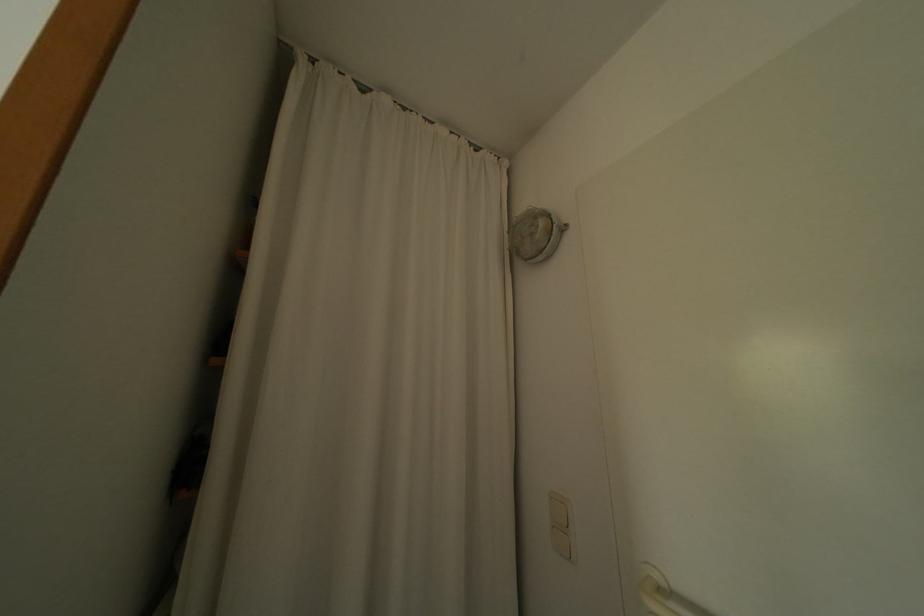
This screenshot has height=616, width=924. I want to click on the bottom light switch button, so pos(561,541).